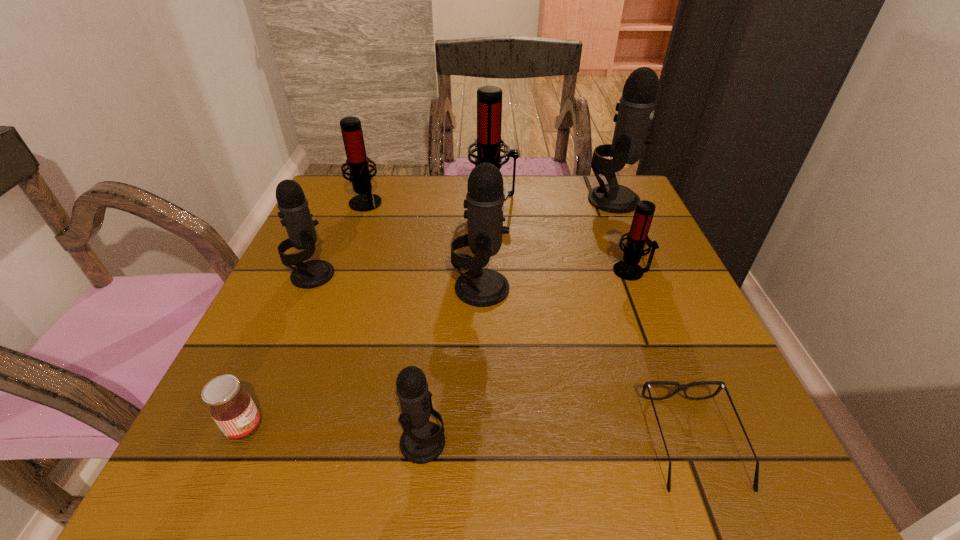
The image size is (960, 540). I want to click on blank area at the near edge, so click(x=318, y=463).

This screenshot has height=540, width=960. Identify the location of vacant area at the left edge. (335, 297).

Where is `free region at the right edge of the desktop`? Image resolution: width=960 pixels, height=540 pixels. free region at the right edge of the desktop is located at coordinates (684, 300).

At what (x,y) coordinates should I click in order to perform the action: click on free region at the far left corner of the desktop. Please return your answer as a coordinate pair (x, y). Looking at the image, I should click on (336, 196).

In the image, there is a desktop. Where is `free space at the near left corner`? free space at the near left corner is located at coordinates (306, 435).

This screenshot has width=960, height=540. In the image, there is a desktop. Find the location of `vacant space at the far right corner`. vacant space at the far right corner is located at coordinates (574, 184).

Find the location of a particular element. The image size is (960, 540). free region at the near right corner of the desktop is located at coordinates (671, 456).

The image size is (960, 540). Find the location of `free space between the smallest black microphone and the jam`. free space between the smallest black microphone and the jam is located at coordinates (334, 435).

You are a GUI agent. You are given a task and a screenshot of the screen. Output one action in this format:
    pyautogui.click(x=<x>, y=<y>)
    Task: Click on the empty space that is in between the eighth tallest object and the biggest red microphone
    Image resolution: width=960 pixels, height=540 pixels.
    Given the screenshot: What is the action you would take?
    pyautogui.click(x=369, y=311)

At what (x,y) coordinates should I click in order to perform the action: click on free spot between the second biggest black microphone and the spectacles. Please return your answer as a coordinate pair (x, y). This screenshot has width=960, height=540. Looking at the image, I should click on (587, 365).